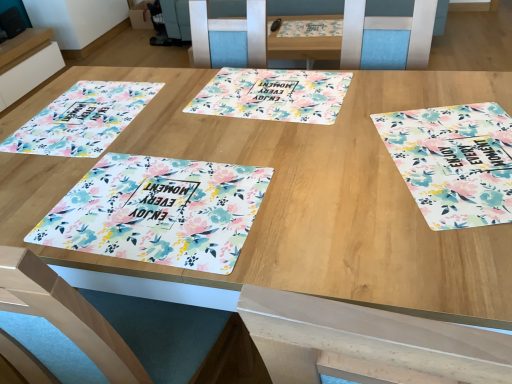
Locate an element on the screen. vacant region below floral printed placemat at left, acting as the 1th tablecloth starting from the left (from a real-world perspective) is located at coordinates (82, 112).